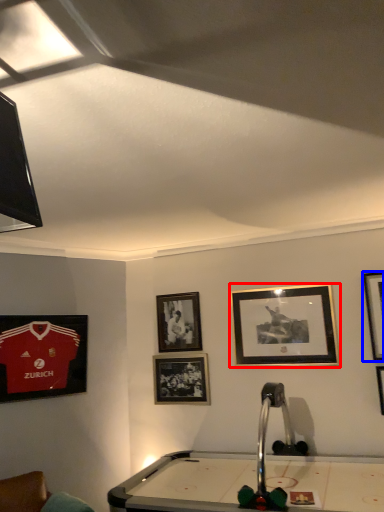
Question: Which point is closer to the camera, picture frame (highlighted by a red box) or picture frame (highlighted by a blue box)?

Choices:
 (A) picture frame
 (B) picture frame

Answer: (B)